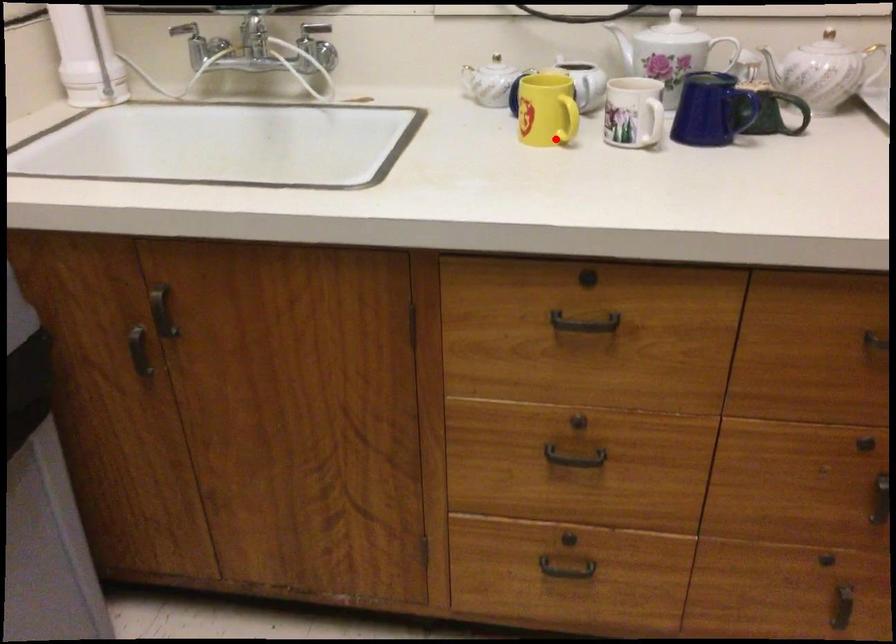
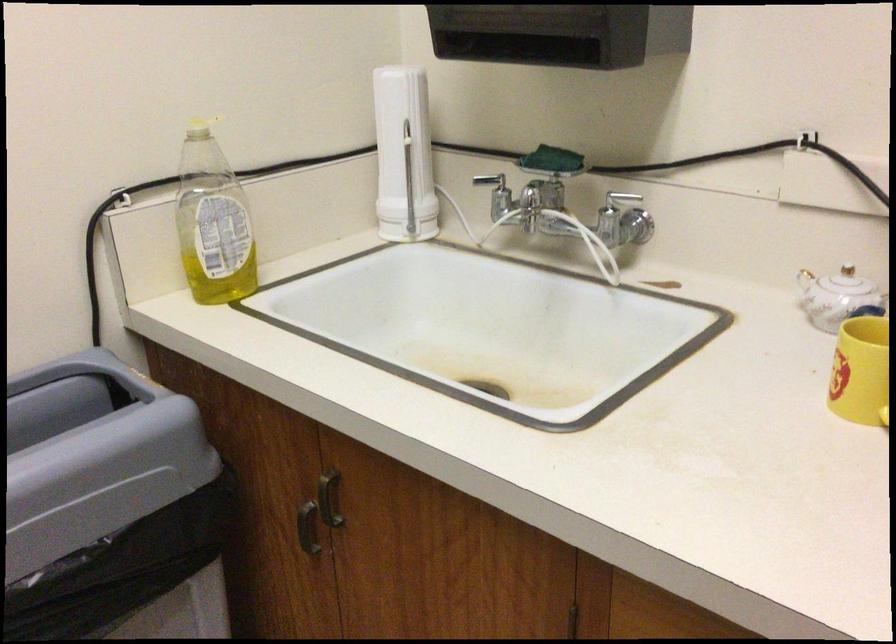
Where in the second image is the point corresponding to the highlighted location from the first image?

(877, 417)